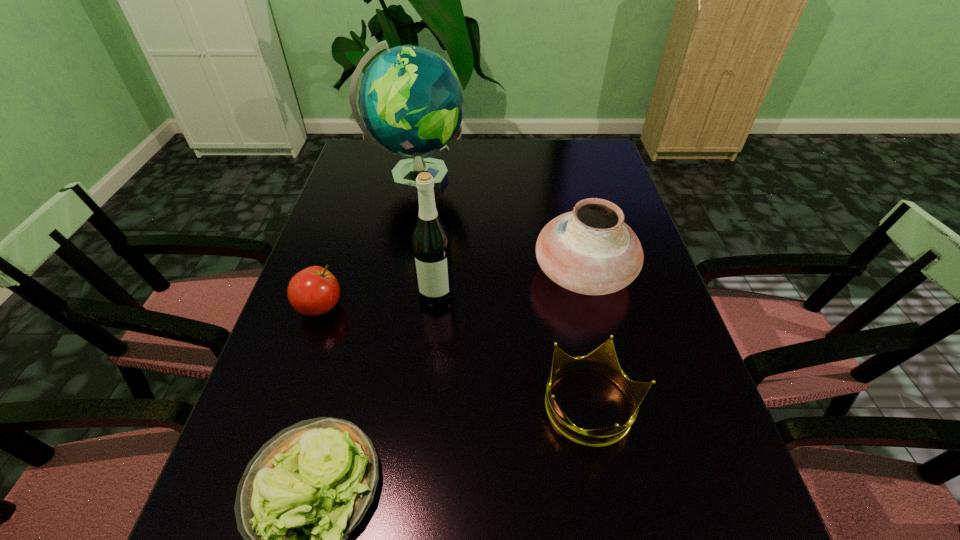
Locate an element on the screen. This screenshot has height=540, width=960. the tallest object is located at coordinates (411, 100).

Where is `globe`? globe is located at coordinates (411, 100).

Image resolution: width=960 pixels, height=540 pixels. In order to click on wine bottle in this screenshot , I will do `click(431, 247)`.

Where is `pottery`? The image size is (960, 540). pottery is located at coordinates (590, 250).

Where is `apple`? apple is located at coordinates (313, 291).

Where is `crown`? Image resolution: width=960 pixels, height=540 pixels. crown is located at coordinates [603, 360].

Locate an element on the screen. vacant space located 0.080m on the front surface of the farthest object is located at coordinates (491, 178).

Locate an element on the screen. This screenshot has height=540, width=960. free space located 0.110m on the label of the wine bottle is located at coordinates (431, 346).

Where is `free spot located on the left of the pottery`? Image resolution: width=960 pixels, height=540 pixels. free spot located on the left of the pottery is located at coordinates (407, 273).

Where is `vacant region located on the right of the apple`? vacant region located on the right of the apple is located at coordinates (373, 307).